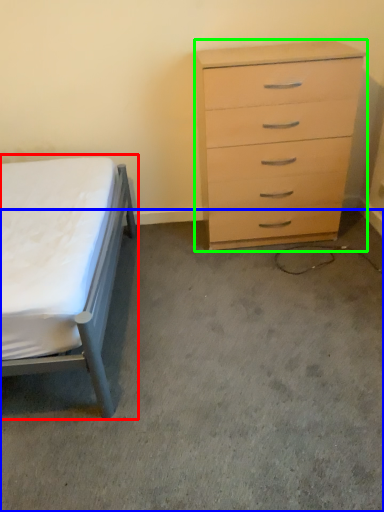
Question: Considering the real-world distances, which object is farthest from bed (highlighted by a red box)? concrete (highlighted by a blue box) or chest of drawers (highlighted by a green box)?

Choices:
 (A) concrete
 (B) chest of drawers

Answer: (B)